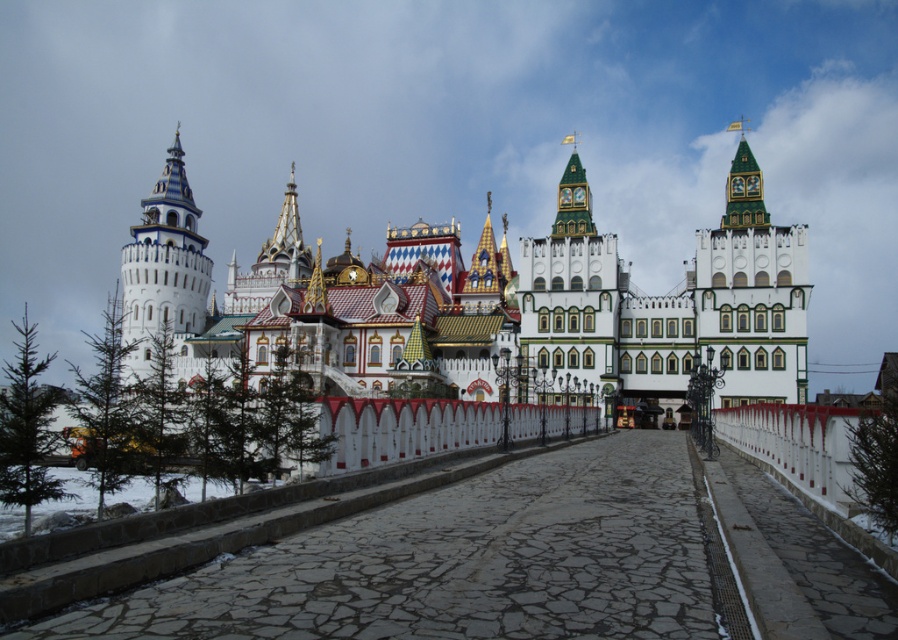
Consider the image. You are standing on the cobblestone pathway in front of the grand building. You see the white painted stone tower at right and the white painted wood clock tower at center. Which tower is closer to you?

The white painted stone tower at right is closer to you because it is in front of the white painted wood clock tower at center.

You are a tourist standing at the entrance of the cobblestone pathway leading to the grand building. You notice two towers in front of you. The first is the white painted stone tower at right, and the second is the white painted wood clock tower at center. Which tower do you see as taller from your current position?

The white painted stone tower at right is taller than the white painted wood clock tower at center, so you would see the white painted stone tower at right as taller from your current position.

You are standing at the entrance of the grand building and see the point marked at coordinates (487, 301). What does this point represent in the scene?

The point at coordinates (487, 301) indicates the white painted stone castle at center.